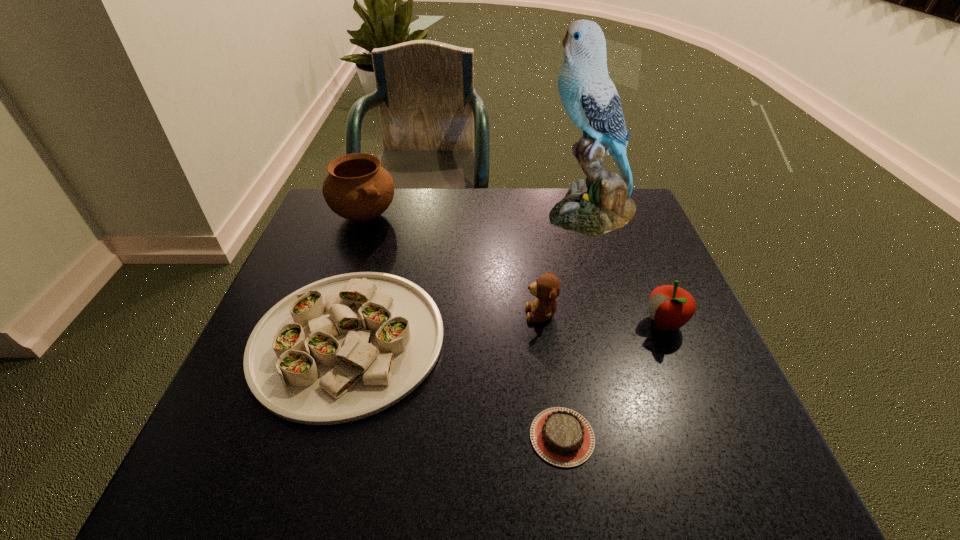
At what (x,y) coordinates should I click in order to perform the action: click on vacant area at the near right corner of the desktop. Please return your answer as a coordinate pair (x, y). Image resolution: width=960 pixels, height=540 pixels. Looking at the image, I should click on (746, 458).

The height and width of the screenshot is (540, 960). What are the coordinates of `free space between the apple and the fifth shortest object` in the screenshot? It's located at (515, 269).

The image size is (960, 540). I want to click on free space between the teddy bear and the chocolate cake, so click(551, 375).

Identify the location of free space between the apple and the pottery. click(x=515, y=269).

Where is `empty location between the teddy bear and the tallest object`? This screenshot has width=960, height=540. empty location between the teddy bear and the tallest object is located at coordinates (565, 264).

The image size is (960, 540). In order to click on vacant area between the tallest object and the platter in this screenshot , I will do `click(469, 276)`.

The width and height of the screenshot is (960, 540). Identify the location of blank region between the shortest object and the tallest object. (576, 325).

You are a GUI agent. You are given a task and a screenshot of the screen. Output one action in this format:
    pyautogui.click(x=<x>, y=<y>)
    Task: Click on the free spot between the pottery and the teddy bear
    This screenshot has height=540, width=960.
    Given the screenshot: What is the action you would take?
    pyautogui.click(x=453, y=264)

Where is `free space between the platter and the teddy bear`? This screenshot has height=540, width=960. free space between the platter and the teddy bear is located at coordinates (444, 327).

This screenshot has width=960, height=540. In order to click on vacant region between the teddy bear and the platter in this screenshot , I will do `click(444, 327)`.